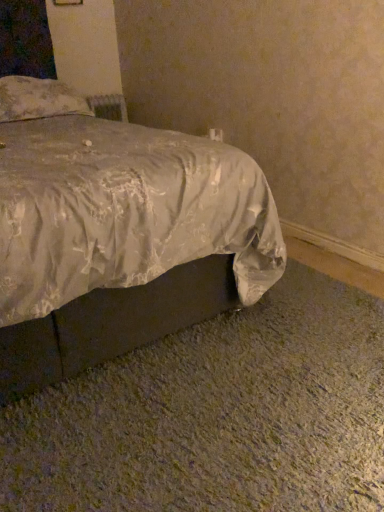
Question: Can you confirm if floral fabric pillow at upper left is shorter than silvery satin bed at lower center?

Choices:
 (A) yes
 (B) no

Answer: (A)

Question: Is floral fabric pillow at upper left further to camera compared to silvery satin bed at lower center?

Choices:
 (A) no
 (B) yes

Answer: (B)

Question: Can you confirm if floral fabric pillow at upper left is positioned to the right of silvery satin bed at lower center?

Choices:
 (A) yes
 (B) no

Answer: (B)

Question: From a real-world perspective, is floral fabric pillow at upper left under silvery satin bed at lower center?

Choices:
 (A) no
 (B) yes

Answer: (A)

Question: Is floral fabric pillow at upper left positioned with its back to silvery satin bed at lower center?

Choices:
 (A) no
 (B) yes

Answer: (B)

Question: Is there a large distance between floral fabric pillow at upper left and silvery satin bed at lower center?

Choices:
 (A) yes
 (B) no

Answer: (A)

Question: Can you confirm if silvery satin bed at lower center is positioned to the right of floral fabric pillow at upper left?

Choices:
 (A) yes
 (B) no

Answer: (A)

Question: From the image's perspective, is silvery satin bed at lower center under floral fabric pillow at upper left?

Choices:
 (A) no
 (B) yes

Answer: (B)

Question: Is silvery satin bed at lower center looking in the opposite direction of floral fabric pillow at upper left?

Choices:
 (A) no
 (B) yes

Answer: (B)

Question: Is silvery satin bed at lower center bigger than floral fabric pillow at upper left?

Choices:
 (A) no
 (B) yes

Answer: (B)

Question: From a real-world perspective, is silvery satin bed at lower center positioned over floral fabric pillow at upper left based on gravity?

Choices:
 (A) no
 (B) yes

Answer: (A)

Question: Is silvery satin bed at lower center in front of floral fabric pillow at upper left?

Choices:
 (A) yes
 (B) no

Answer: (A)

Question: Is floral fabric pillow at upper left inside or outside of silvery satin bed at lower center?

Choices:
 (A) inside
 (B) outside

Answer: (A)